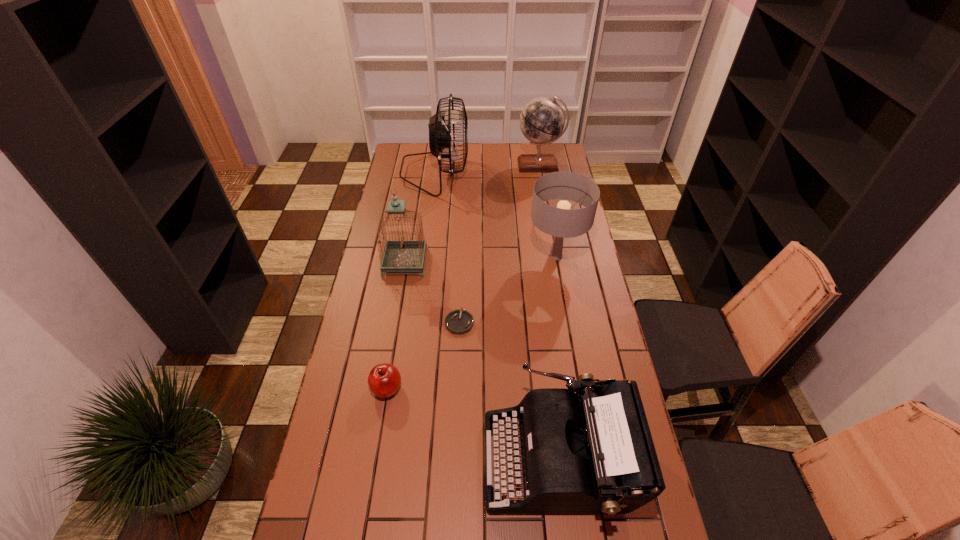
Locate an element on the screen. This screenshot has width=960, height=540. free location that satisfies the following two spatial constraints: 1. on the front-facing side of the lampshade; 2. on the typing side of the third shortest object is located at coordinates (591, 458).

Locate an element on the screen. This screenshot has height=540, width=960. blank area in the image that satisfies the following two spatial constraints: 1. on the front-facing side of the lampshade; 2. at the door of the birdcage is located at coordinates (557, 262).

This screenshot has height=540, width=960. I want to click on free spot that satisfies the following two spatial constraints: 1. in front of the fan, directing airflow; 2. on the front side of the apple, so click(x=408, y=388).

Identify the location of vacant region that satisfies the following two spatial constraints: 1. on the front-facing side of the lampshade; 2. on the typing side of the fifth tallest object. (591, 458).